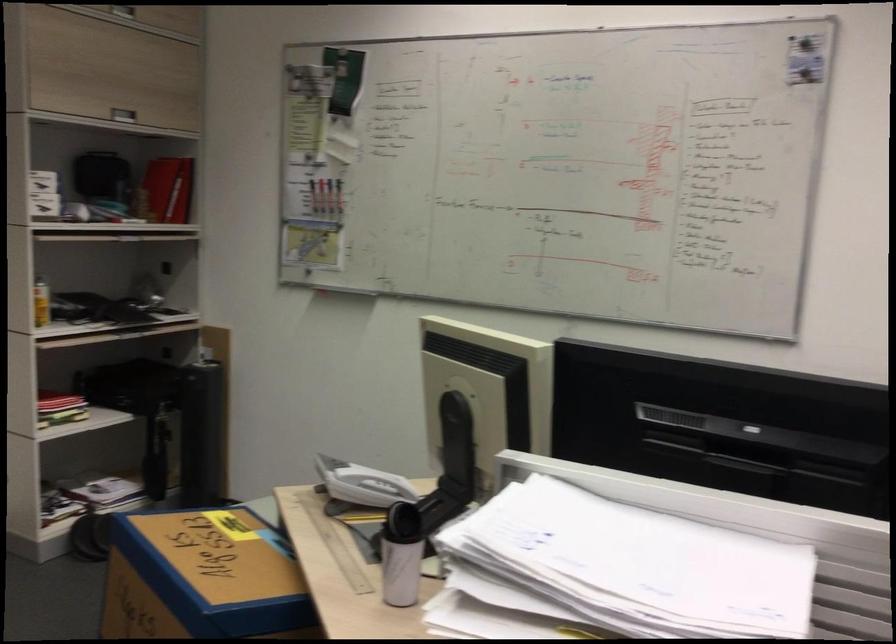
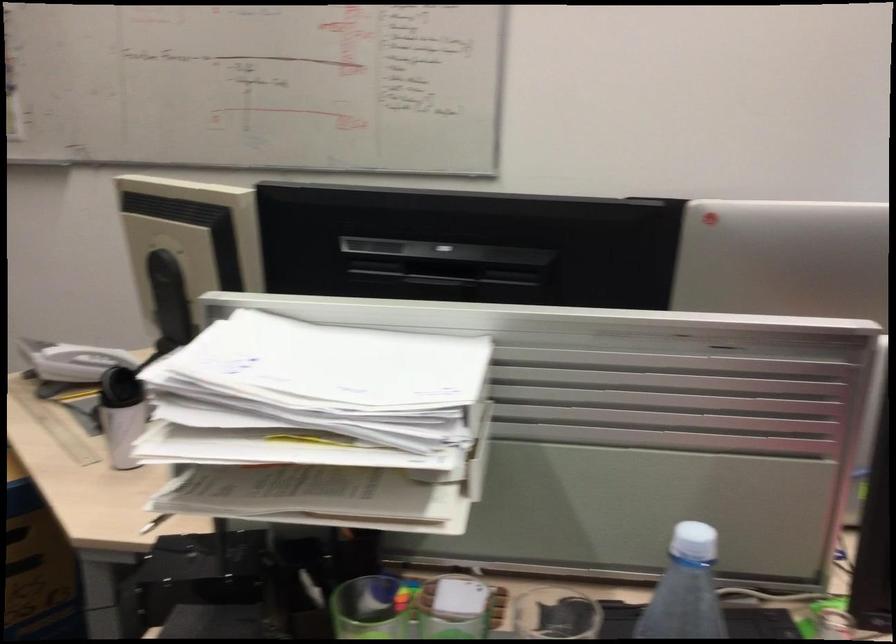
The images are taken continuously from a first-person perspective. In which direction are you moving?

The movement direction of the cameraman is right, backward.